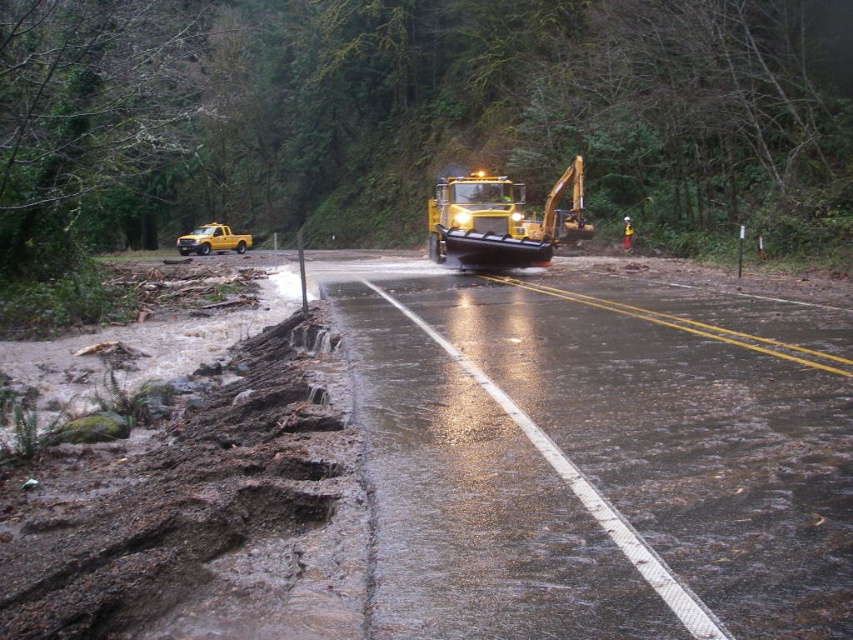
Does wet asphalt road at center come behind yellow matte truck at left?

No, wet asphalt road at center is in front of yellow matte truck at left.

Looking at this image, is wet asphalt road at center to the left of yellow matte truck at left from the viewer's perspective?

No, wet asphalt road at center is not to the left of yellow matte truck at left.

Measure the distance between point (392, 392) and camera.

Point (392, 392) and camera are 7.72 meters apart.

Where is `wet asphalt road at center`? Image resolution: width=853 pixels, height=640 pixels. wet asphalt road at center is located at coordinates (592, 470).

Is yellow rubber excavator at center to the left of yellow hard hat at center from the viewer's perspective?

Correct, you'll find yellow rubber excavator at center to the left of yellow hard hat at center.

Which is behind, point (462, 234) or point (630, 225)?

The point (630, 225) is more distant.

At what (x,y) coordinates should I click in order to perform the action: click on yellow rubber excavator at center. Please return your answer as a coordinate pair (x, y). Looking at the image, I should click on (502, 220).

Is wet asphalt road at center below yellow rubber excavator at center?

Yes.

What are the coordinates of `wet asphalt road at center` in the screenshot? It's located at (592, 470).

Where is `wet asphalt road at center`? Image resolution: width=853 pixels, height=640 pixels. wet asphalt road at center is located at coordinates (592, 470).